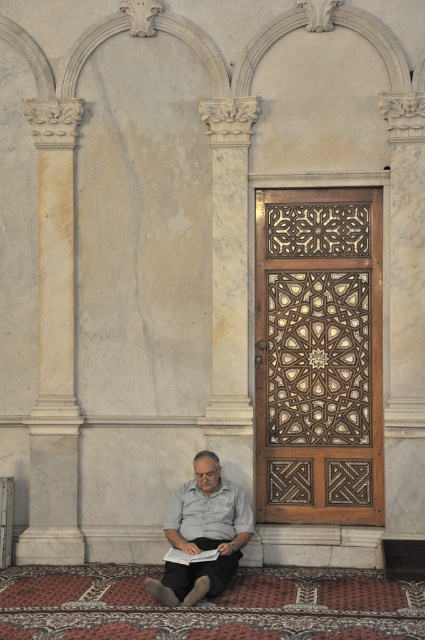
Question: Is gray cotton shirt at lower center further to camera compared to white paper book at lower center?

Choices:
 (A) yes
 (B) no

Answer: (B)

Question: Estimate the real-world distances between objects in this image. Which object is closer to the white marble column at left?

Choices:
 (A) white paper book at lower center
 (B) white cotton shirt at lower center

Answer: (B)

Question: Is white marble column at left positioned before white paper book at lower center?

Choices:
 (A) yes
 (B) no

Answer: (B)

Question: Which of the following is the farthest from the observer?

Choices:
 (A) (57, 216)
 (B) (178, 570)

Answer: (A)

Question: Which point is closer to the camera taking this photo?

Choices:
 (A) (217, 508)
 (B) (53, 144)
 (C) (210, 524)

Answer: (C)

Question: Does white marble column at left appear on the right side of white cotton shirt at lower center?

Choices:
 (A) no
 (B) yes

Answer: (A)